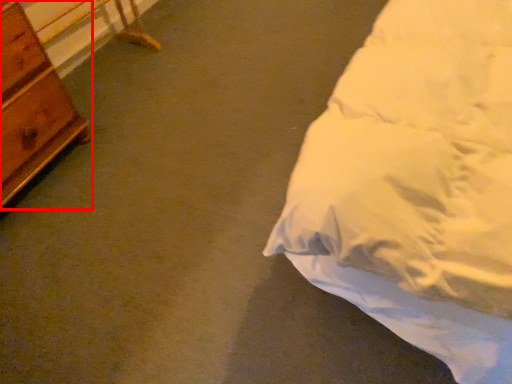
Question: From the image's perspective, what is the correct spatial relationship of chest of drawers (annotated by the red box) in relation to table?

Choices:
 (A) above
 (B) below

Answer: (B)